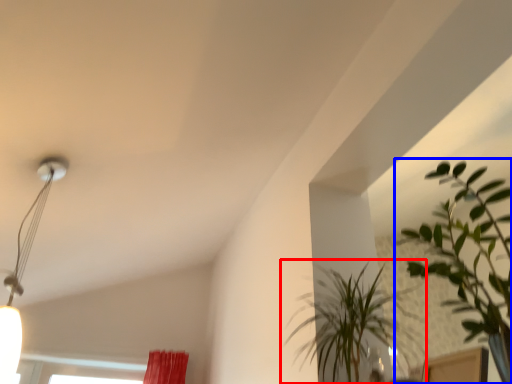
Question: Among these objects, which one is nearest to the camera, houseplant (highlighted by a red box) or houseplant (highlighted by a blue box)?

Choices:
 (A) houseplant
 (B) houseplant

Answer: (B)